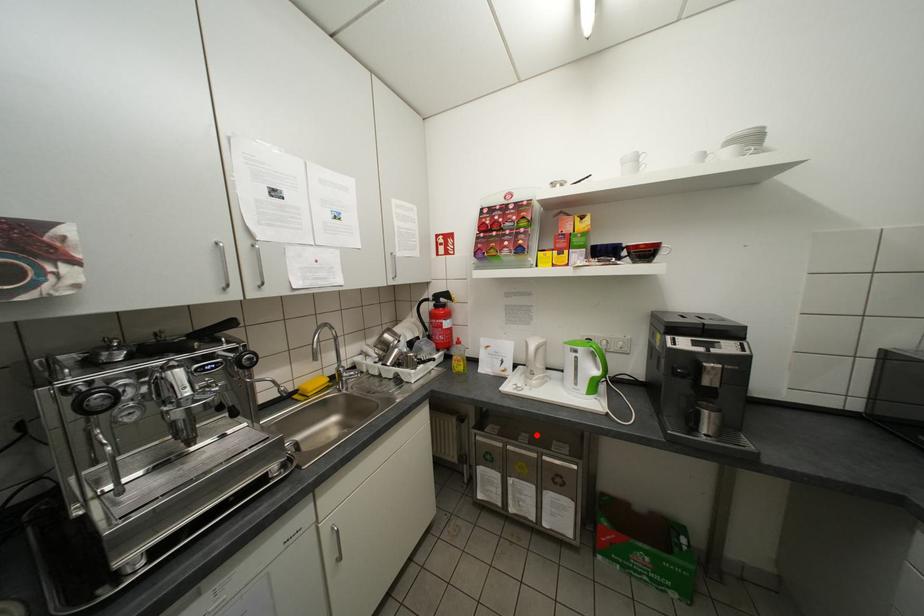
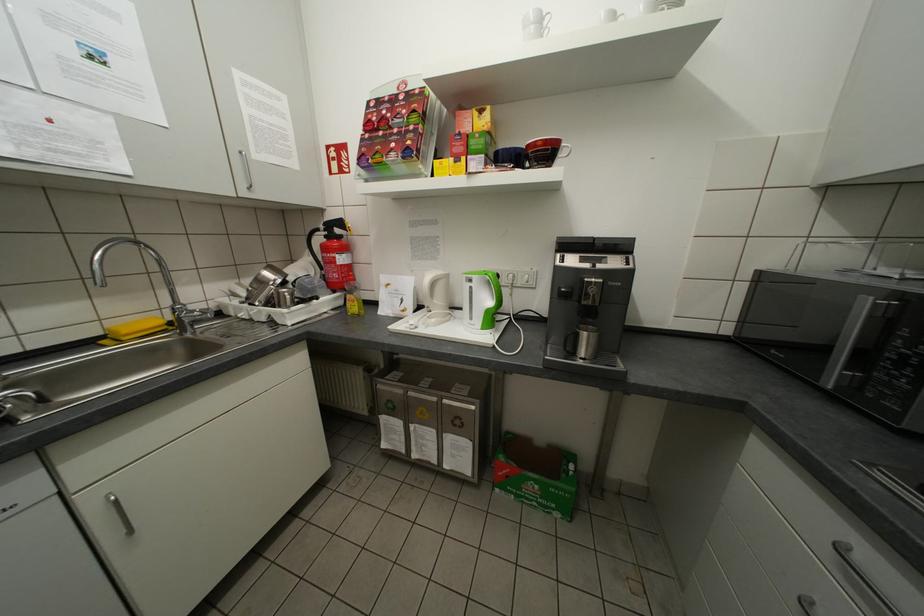
The point at the highlighted location is marked in the first image. Where is the corresponding point in the second image?

(440, 379)